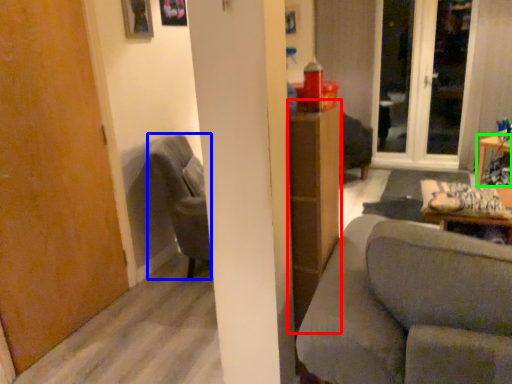
Question: Considering the real-world distances, which object is closest to dresser (highlighted by a red box)? chair (highlighted by a blue box) or table (highlighted by a green box).

Choices:
 (A) chair
 (B) table

Answer: (A)